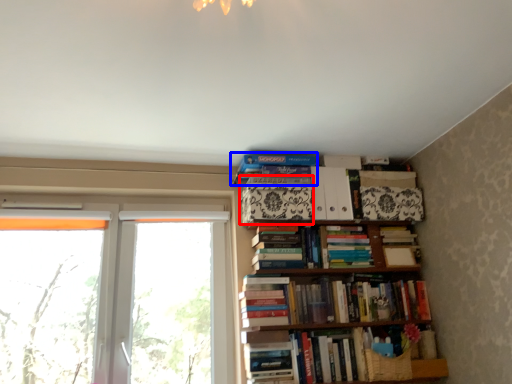
Question: Which point is closer to the camera, paperback book (highlighted by a red box) or book (highlighted by a blue box)?

Choices:
 (A) paperback book
 (B) book

Answer: (A)